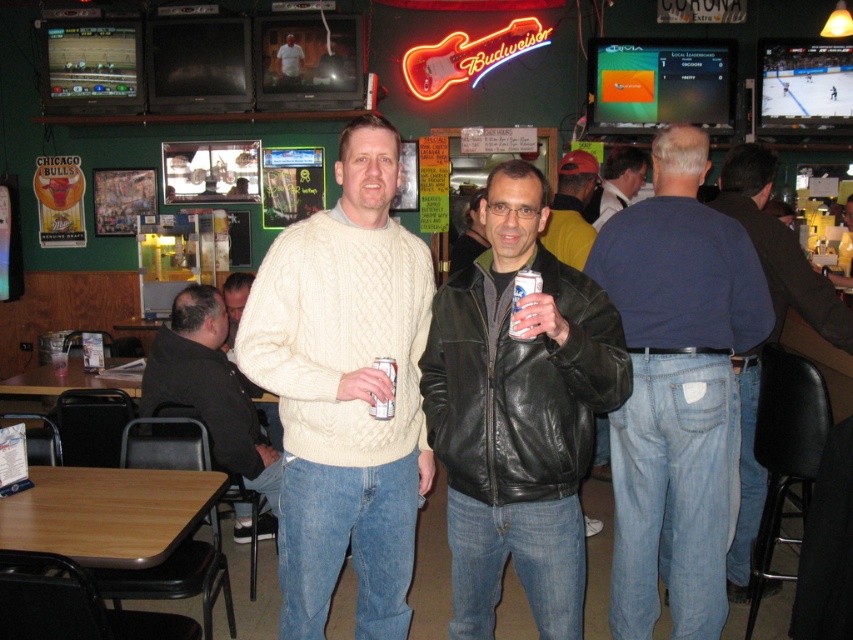
Question: Can you confirm if yellow leather jacket at center is wider than leather jacket at center?

Choices:
 (A) no
 (B) yes

Answer: (B)

Question: Is black leather jacket at center in front of yellow leather jacket at center?

Choices:
 (A) no
 (B) yes

Answer: (B)

Question: Which is farther from the yellow leather jacket at center?

Choices:
 (A) matte black jacket at center
 (B) black leather jacket at left

Answer: (B)

Question: Does yellow leather jacket at center appear on the right side of leather jacket at center?

Choices:
 (A) no
 (B) yes

Answer: (B)

Question: Which of the following is the farthest from the observer?

Choices:
 (A) (450, 422)
 (B) (695, 467)

Answer: (B)

Question: Based on their relative distances, which object is nearer to the jeans at center?

Choices:
 (A) leather jacket at center
 (B) blue cotton shirt at back

Answer: (B)